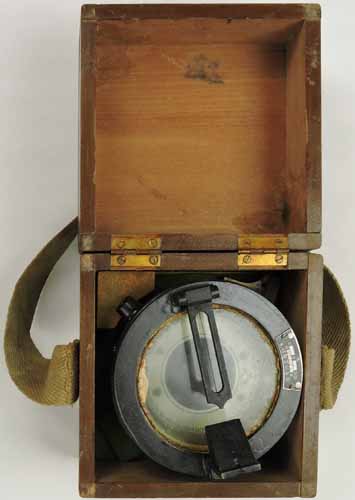
You are a GUI agent. You are given a task and a screenshot of the screen. Output one action in this format:
    pyautogui.click(x=<x>, y=<y>)
    Task: Click on the hinges
    The image size is (355, 500).
    Given the screenshot: What is the action you would take?
    pyautogui.click(x=137, y=248), pyautogui.click(x=261, y=252)